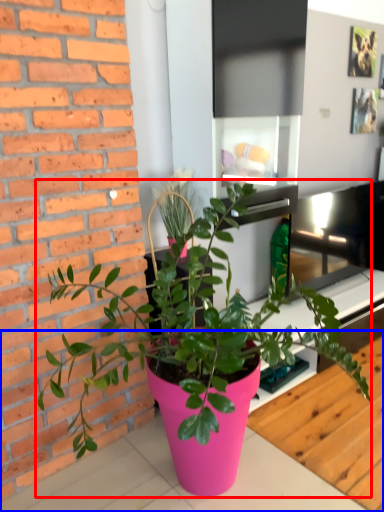
Question: Which of the following is the closest to the observer, houseplant (highlighted by a red box) or table (highlighted by a blue box)?

Choices:
 (A) houseplant
 (B) table

Answer: (A)